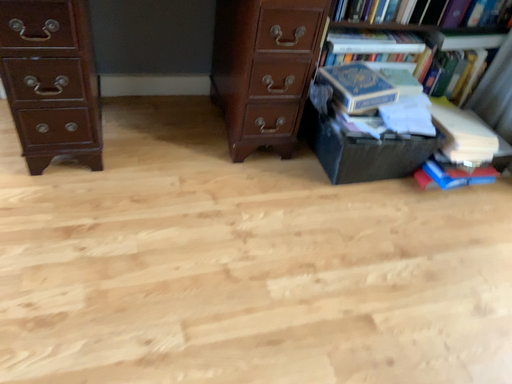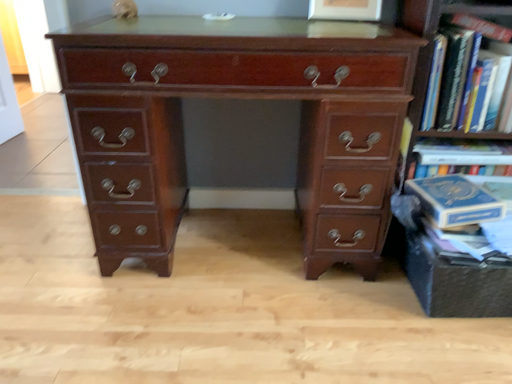
Question: How did the camera likely rotate when shooting the video?

Choices:
 (A) rotated right
 (B) rotated left

Answer: (B)